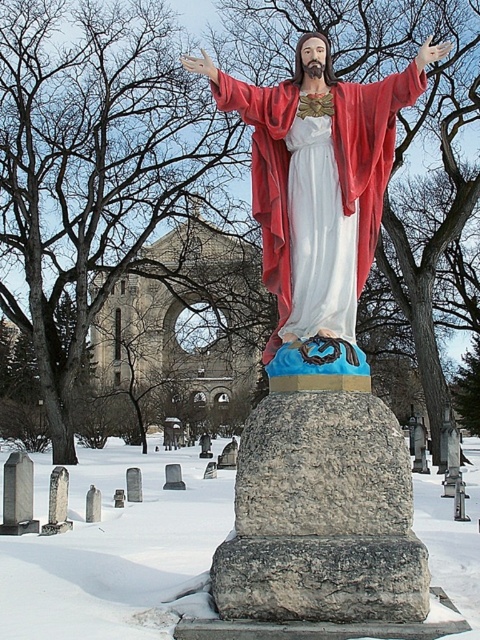
Is white snow at center above velvet red robe at center?

Actually, white snow at center is below velvet red robe at center.

Is white snow at center below velvet red robe at center?

Indeed, white snow at center is positioned under velvet red robe at center.

Is point (200, 499) positioned before point (354, 84)?

No, it is behind (354, 84).

This screenshot has width=480, height=640. What are the coordinates of `white snow at center` in the screenshot? It's located at (119, 554).

Is matte red statue at center further to the viewer compared to gray stone gravestone at center?

Yes, matte red statue at center is further from the viewer.

Which is below, matte red statue at center or gray stone gravestone at center?

Positioned lower is gray stone gravestone at center.

Between point (223, 88) and point (243, 492), which one is positioned in front?

Point (243, 492)

Identify the location of matte red statue at center. The image size is (480, 640). (322, 512).

Is matte red statue at center to the left of white snow at center from the viewer's perspective?

Indeed, matte red statue at center is positioned on the left side of white snow at center.

Between point (261, 536) and point (155, 477), which one is positioned behind?

The point (155, 477) is behind.

Consider the image. Measure the distance between point [414,586] and camera.

They are 7.12 meters apart.

Locate an element on the screen. matte red statue at center is located at coordinates (322, 512).